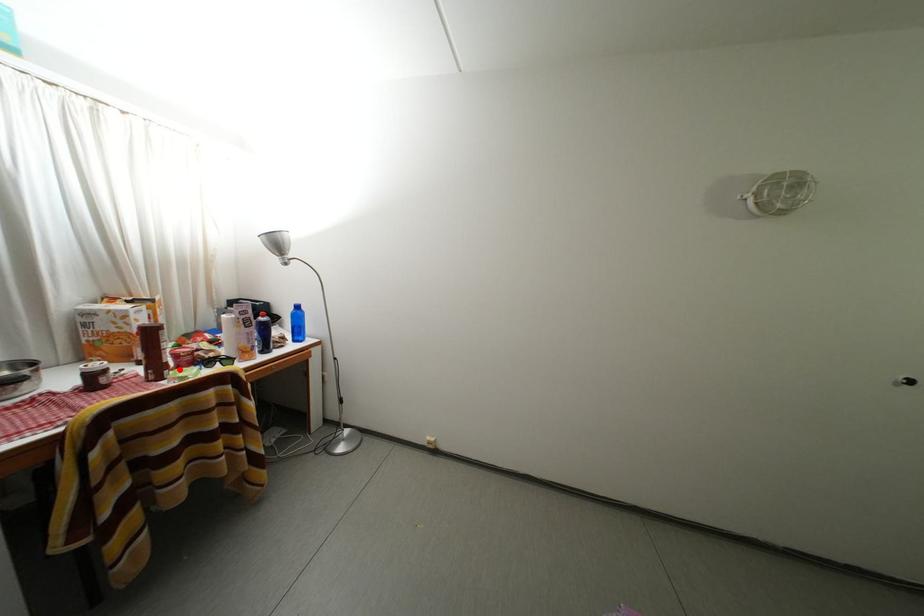
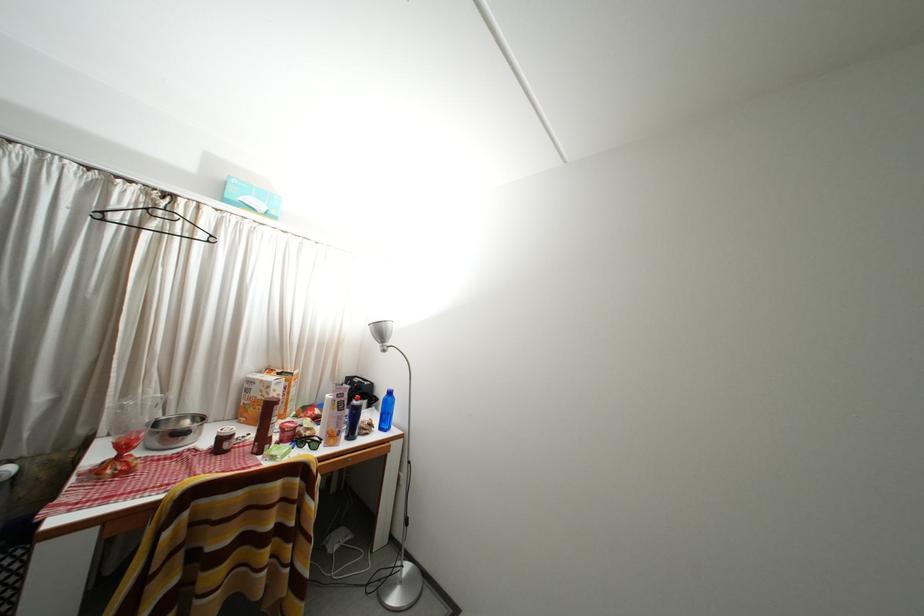
Find the pixel in the second image that matches the highlighted location in the first image.

(284, 444)